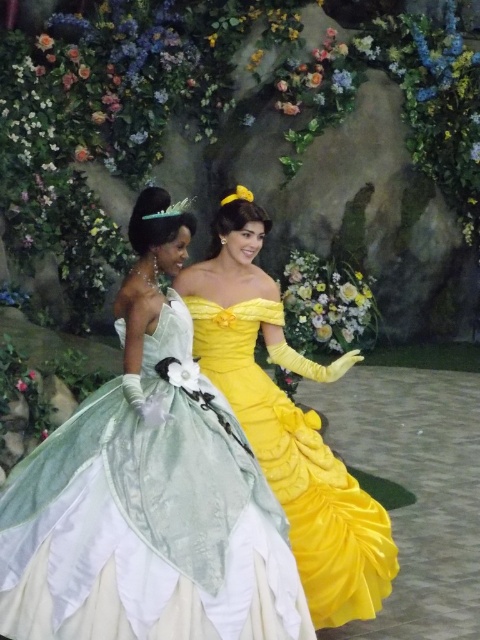
You are an artist sketching the scene. You need to place the matte green gown at center in your drawing. What are the coordinates where you should position it?

The matte green gown at center should be positioned at coordinates (147,492).

You are a photographer setting up for a photoshoot with two models wearing the matte green gown at center and the yellow satin dress at center. You need to position them so that the smaller dress doesn

The matte green gown at center is bigger than yellow satin dress at center, so you should position the yellow satin dress at center closer to the camera to make it appear larger in the photo.

You are a photographer planning to take a group photo of the matte green gown at center and the yellow satin dress at center. The minimum distance required for your camera to focus clearly on both subjects simultaneously is 25 inches. Based on the current positioning, will both subjects be in focus?

The matte green gown at center is 24.91 inches away from the yellow satin dress at center. Since the distance between them is less than the camera requirement of 25 inches, the camera will not be able to focus clearly on both subjects at the same time.